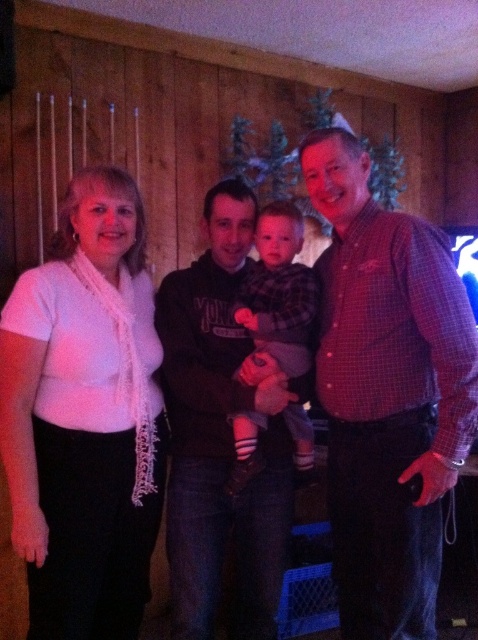
Question: Which point appears closest to the camera in this image?

Choices:
 (A) (183, 298)
 (B) (395, 276)
 (C) (86, 474)

Answer: (B)

Question: Is white lace scarf at left smaller than flannel shirt at center?

Choices:
 (A) no
 (B) yes

Answer: (A)

Question: Which object appears farthest from the camera in this image?

Choices:
 (A) white lace scarf at left
 (B) plaid shirt at right
 (C) dark brown hoodie at center
 (D) flannel shirt at center

Answer: (D)

Question: Which point is farther to the camera?

Choices:
 (A) white lace scarf at left
 (B) flannel shirt at center
 (C) plaid shirt at right
 (D) dark brown hoodie at center

Answer: (B)

Question: Can you confirm if white lace scarf at left is wider than flannel shirt at center?

Choices:
 (A) no
 (B) yes

Answer: (B)

Question: Is white lace scarf at left behind plaid shirt at right?

Choices:
 (A) no
 (B) yes

Answer: (B)